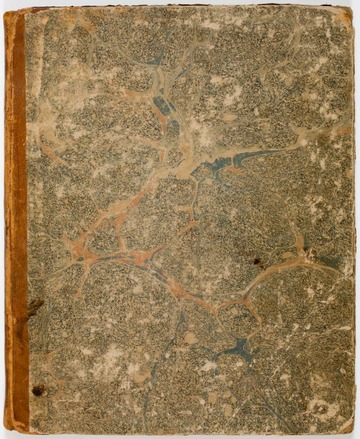
Identify the location of frayed binder of book cover. (12, 425), (10, 17).